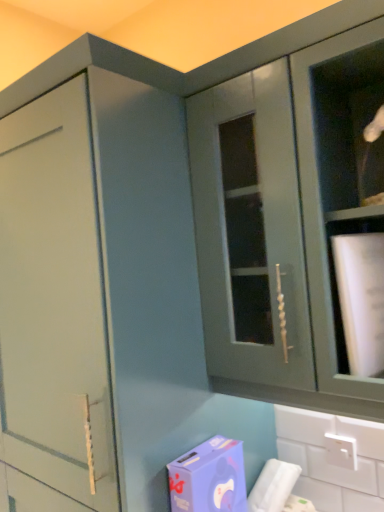
Question: In the image, is purple matte cardboard box at lower center positioned in front of or behind matte green cabinet at upper right?

Choices:
 (A) behind
 (B) front

Answer: (A)

Question: From the image's perspective, relative to matte green cabinet at upper right, is purple matte cardboard box at lower center above or below?

Choices:
 (A) below
 (B) above

Answer: (A)

Question: From a real-world perspective, relative to matte green cabinet at upper right, is purple matte cardboard box at lower center vertically above or below?

Choices:
 (A) below
 (B) above

Answer: (A)

Question: In terms of height, does matte green cabinet at upper right look taller or shorter compared to purple matte cardboard box at lower center?

Choices:
 (A) short
 (B) tall

Answer: (B)

Question: Is matte green cabinet at upper right to the left or to the right of purple matte cardboard box at lower center in the image?

Choices:
 (A) left
 (B) right

Answer: (B)

Question: Is point (258, 80) positioned closer to the camera than point (231, 486)?

Choices:
 (A) closer
 (B) farther

Answer: (A)

Question: In terms of width, does matte green cabinet at upper right look wider or thinner when compared to purple matte cardboard box at lower center?

Choices:
 (A) thin
 (B) wide

Answer: (B)